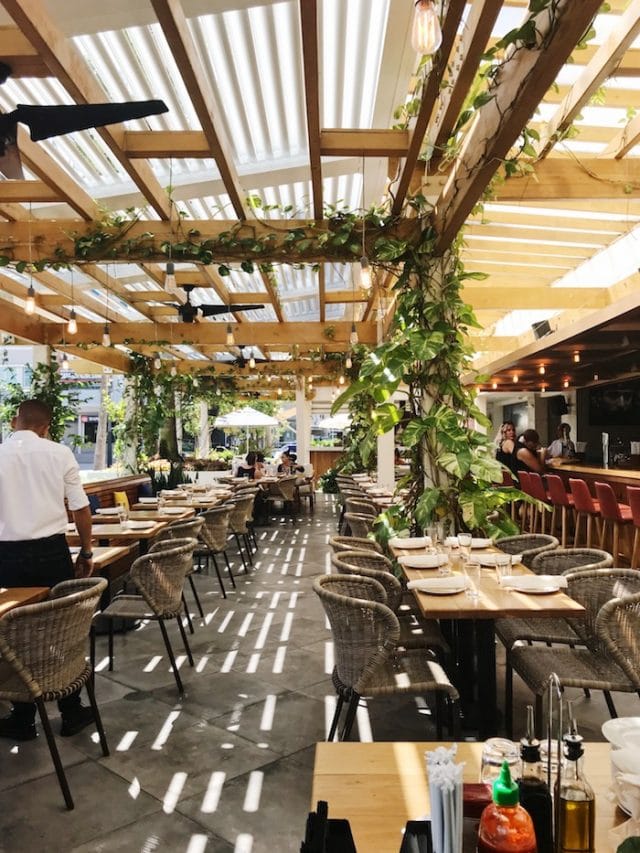
At what (x,y) coordinates should I click in order to perform the action: click on chair. Please return your answer as a coordinate pair (x, y). This screenshot has width=640, height=853. Looking at the image, I should click on (424, 680).